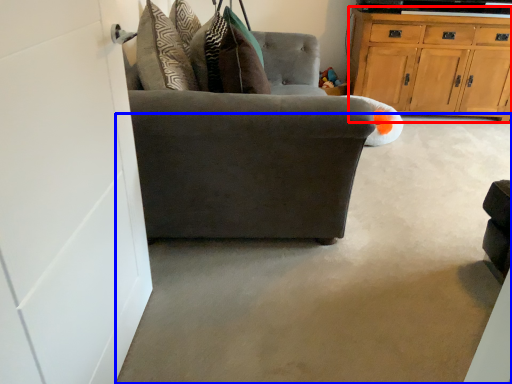
Question: Which point is further to the camera, cabinetry (highlighted by a red box) or concrete (highlighted by a blue box)?

Choices:
 (A) cabinetry
 (B) concrete

Answer: (A)